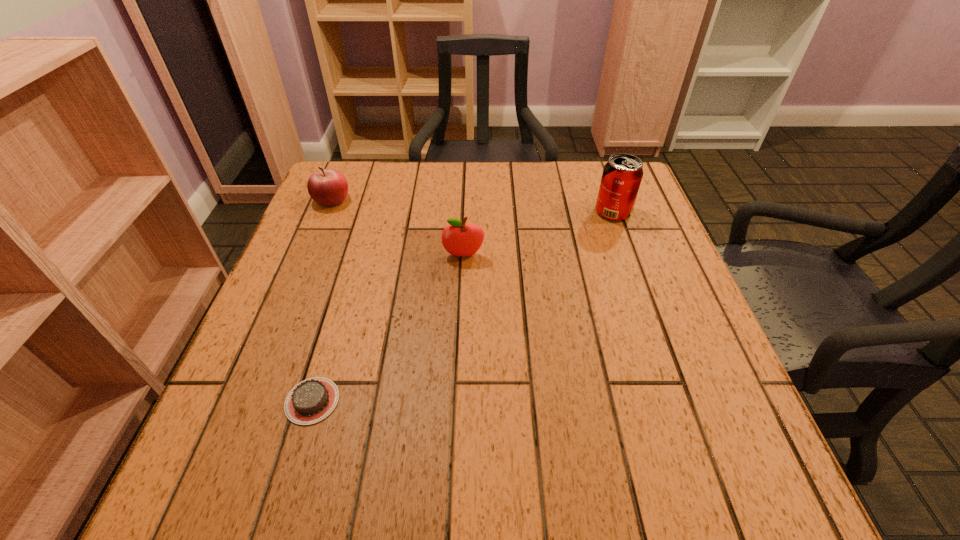
The width and height of the screenshot is (960, 540). Find the location of `free region located 0.070m on the right of the left apple`. free region located 0.070m on the right of the left apple is located at coordinates click(377, 199).

This screenshot has height=540, width=960. I want to click on free space located 0.070m on the front of the shortest object, so click(292, 470).

The height and width of the screenshot is (540, 960). In order to click on soda can present at the far edge in this screenshot , I will do `click(622, 174)`.

Find the location of a particular element. Image resolution: width=960 pixels, height=540 pixels. apple located in the far edge section of the desktop is located at coordinates (328, 187).

Where is `apple that is at the left edge`? Image resolution: width=960 pixels, height=540 pixels. apple that is at the left edge is located at coordinates pyautogui.click(x=328, y=187).

Image resolution: width=960 pixels, height=540 pixels. What are the coordinates of `chocolate cake situated at the left edge` in the screenshot? It's located at (310, 401).

Find the location of a particular element. This screenshot has height=540, width=960. object positioned at the right edge is located at coordinates (622, 174).

In order to click on object at the far left corner in this screenshot , I will do `click(328, 187)`.

I want to click on object at the far right corner, so (622, 174).

Identify the location of free space at the far edge of the desktop. (401, 175).